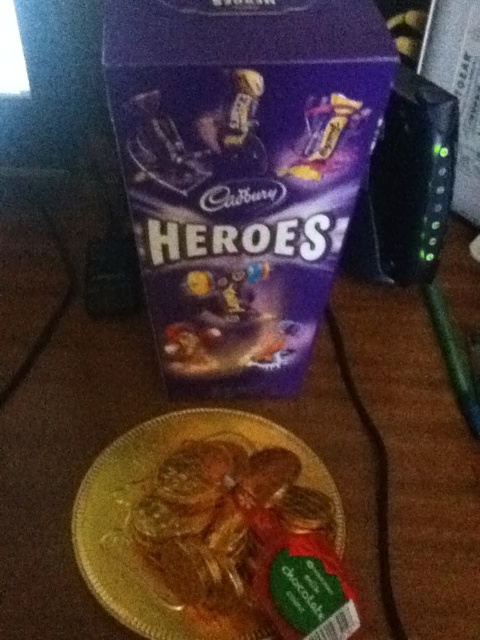
Question: Which object is closer to the camera taking this photo?

Choices:
 (A) purple glossy chocolate box at upper center
 (B) golden textured cookies at center
 (C) gold foil plate at center

Answer: (A)

Question: Does purple glossy chocolate box at upper center have a smaller size compared to golden textured cookies at center?

Choices:
 (A) yes
 (B) no

Answer: (B)

Question: Can you confirm if gold foil plate at center is smaller than golden textured cookies at center?

Choices:
 (A) no
 (B) yes

Answer: (A)

Question: Which point appears closest to the camera in this image?

Choices:
 (A) (193, 449)
 (B) (103, 35)
 (C) (479, 572)

Answer: (C)

Question: Which point is closer to the camera?

Choices:
 (A) (101, 404)
 (B) (175, 572)

Answer: (B)

Question: In this image, where is purple glossy chocolate box at upper center located relative to golden textured cookies at center?

Choices:
 (A) right
 (B) left

Answer: (A)